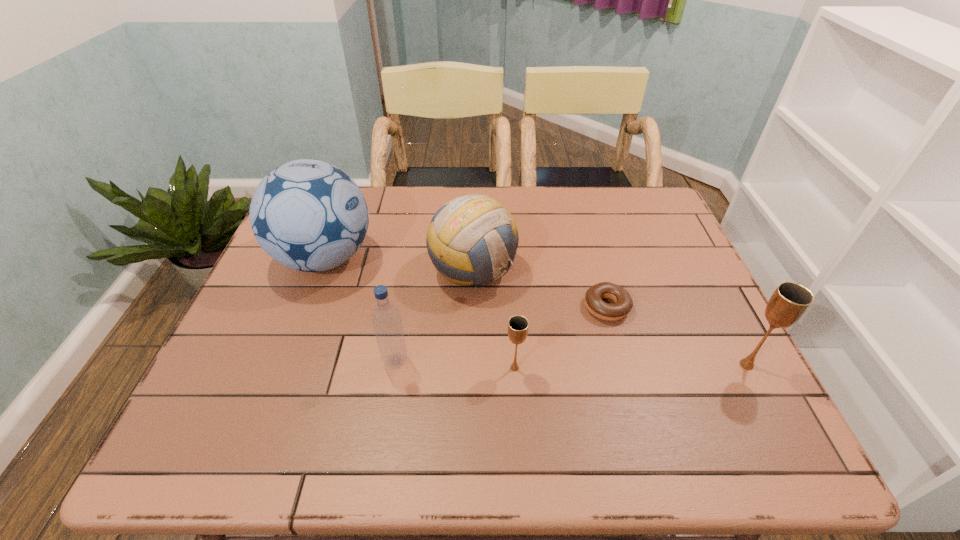
Where is `vacant place for an extra chalice on the left`? This screenshot has height=540, width=960. vacant place for an extra chalice on the left is located at coordinates (279, 371).